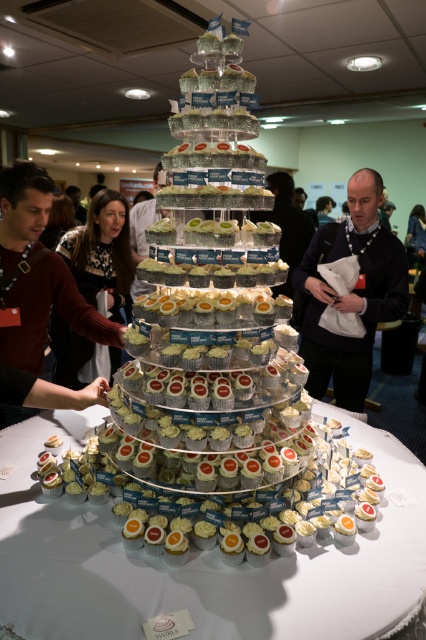
Question: Can you confirm if dark blue sweater at center is positioned to the right of matte black jacket at center?

Choices:
 (A) no
 (B) yes

Answer: (B)

Question: Which is nearer to the dark brown sweater at center?

Choices:
 (A) white paper cupcake tower at center
 (B) dark brown leather jacket at center

Answer: (A)

Question: Is white frosted cupcake tower at center above dark brown leather jacket at center?

Choices:
 (A) yes
 (B) no

Answer: (B)

Question: Which point appears closest to the camera in this image?

Choices:
 (A) (25, 413)
 (B) (141, 212)

Answer: (A)

Question: Is dark blue sweater at center to the right of matte black jacket at center from the viewer's perspective?

Choices:
 (A) no
 (B) yes

Answer: (B)

Question: Which object is positioned closest to the dark brown sweater at center?

Choices:
 (A) dark blue sweater at center
 (B) dark brown leather jacket at center
 (C) white frosted cupcake tower at center
 (D) matte black jacket at center

Answer: (D)